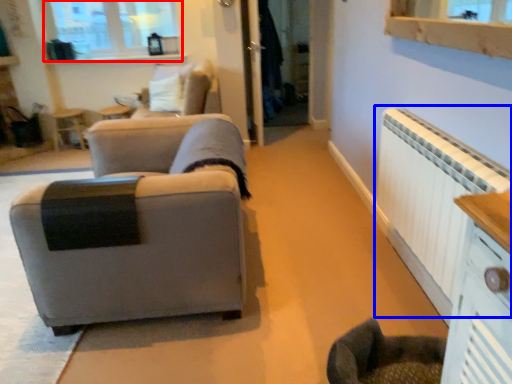
Question: Which object appears closest to the camera in this image, window (highlighted by a red box) or radiator (highlighted by a blue box)?

Choices:
 (A) window
 (B) radiator

Answer: (B)